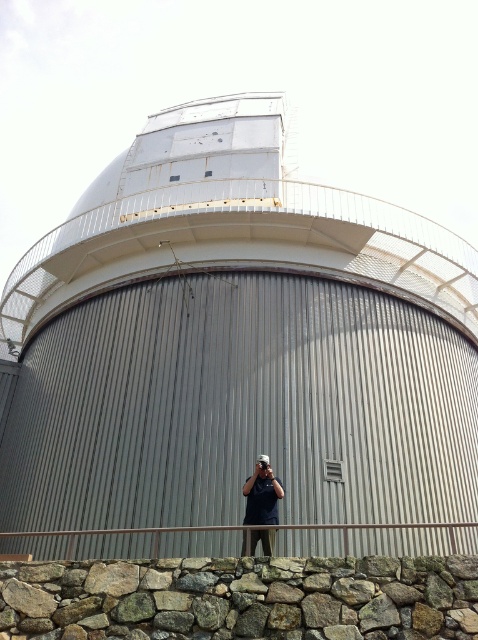
Which of these two, rusty metal observatory at center or dark blue shirt at center, stands taller?

rusty metal observatory at center is taller.

Is the position of rusty metal observatory at center more distant than that of dark blue shirt at center?

That is False.

What are the coordinates of `rusty metal observatory at center` in the screenshot? It's located at (236, 355).